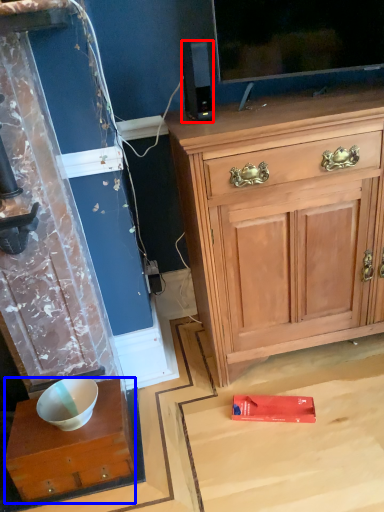
Question: Which object appears closest to the camera in this image, loudspeaker (highlighted by a red box) or desk (highlighted by a blue box)?

Choices:
 (A) loudspeaker
 (B) desk

Answer: (B)